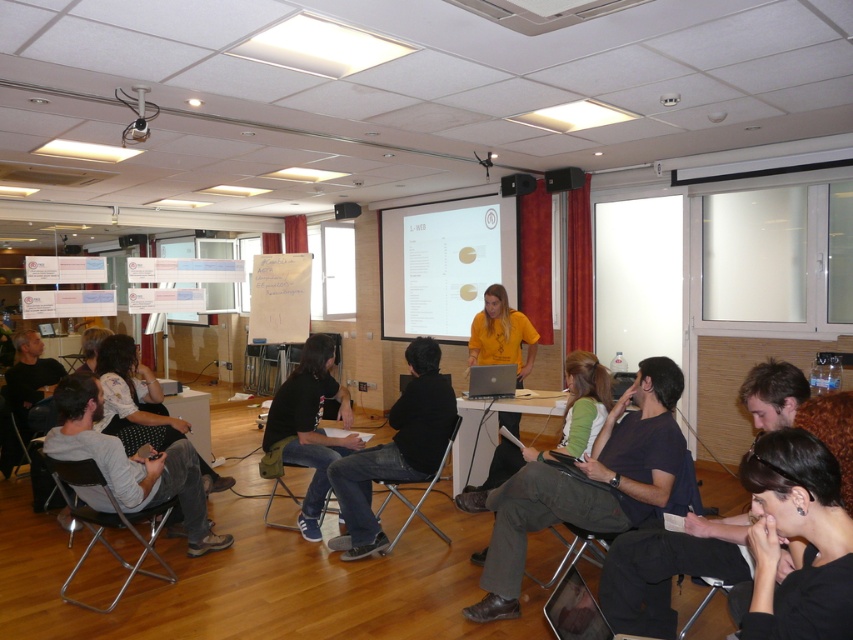
Can you confirm if black fabric chair at center is smaller than silver metallic laptop at center?

Incorrect, black fabric chair at center is not smaller in size than silver metallic laptop at center.

Does black fabric chair at center have a lesser height compared to silver metallic laptop at center?

No.

Is point (396, 534) farther from viewer compared to point (489, 394)?

No, (396, 534) is in front of (489, 394).

Image resolution: width=853 pixels, height=640 pixels. I want to click on black fabric chair at center, so click(x=421, y=496).

Who is higher up, dark brown fabric pants at lower center or black matte hair at lower right?

black matte hair at lower right

Which is more to the right, dark brown fabric pants at lower center or black matte hair at lower right?

Positioned to the right is black matte hair at lower right.

Which is in front, point (517, 481) or point (822, 536)?

Point (822, 536)

Locate an element on the screen. The height and width of the screenshot is (640, 853). dark brown fabric pants at lower center is located at coordinates (587, 484).

Which is more to the left, black matte hair at lower right or black fabric chair at center?

black fabric chair at center

The width and height of the screenshot is (853, 640). Describe the element at coordinates (798, 536) in the screenshot. I see `black matte hair at lower right` at that location.

Describe the element at coordinates (798, 536) in the screenshot. I see `black matte hair at lower right` at that location.

Where is `black matte hair at lower right`? The image size is (853, 640). black matte hair at lower right is located at coordinates (798, 536).